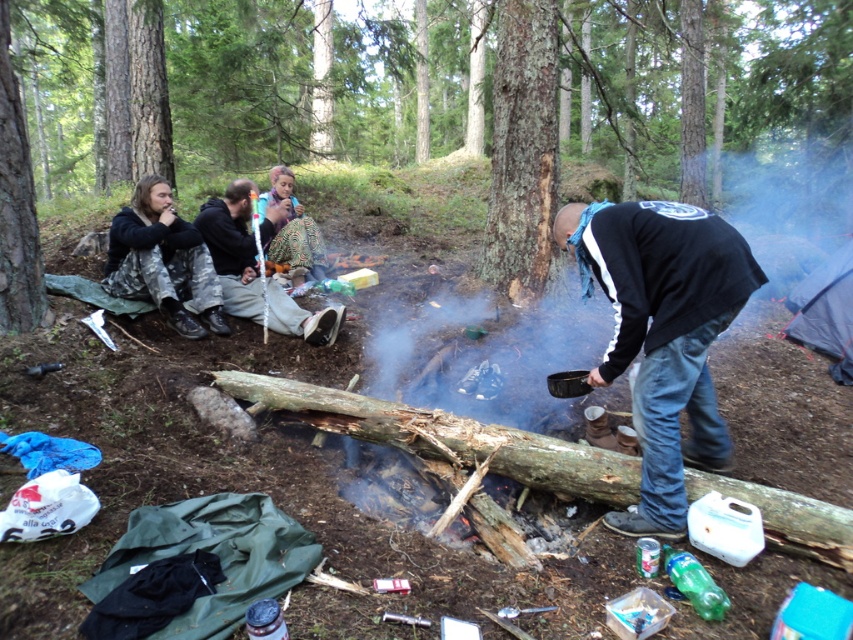
You are a photographer at the campfire scene. You need to position yourself so that you can capture both the black fleece jacket at center and the patterned fabric skirt at center in the same frame. Which direction should you face to ensure both subjects are visible?

You should face towards the left side of the scene because the black fleece jacket at center is to the right of the patterned fabric skirt at center, so facing left will allow both to be in the frame.

Based on the photo, you are planning to place a small table between the camouflage pants at left and the blue fabric tent at right. Based on their widths, can the table fit between them?

The camouflage pants at left has a lesser width compared to blue fabric tent at right, so the table can fit between them as there is enough space.